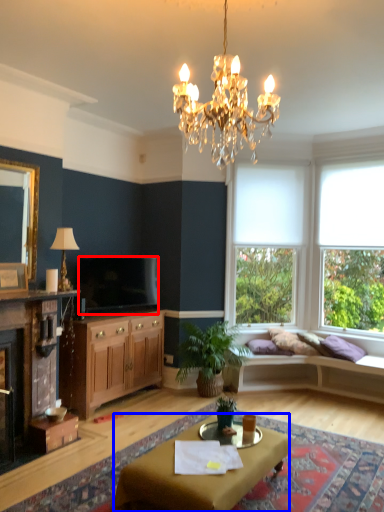
Question: Which point is closer to the camera, television (highlighted by a red box) or desk (highlighted by a blue box)?

Choices:
 (A) television
 (B) desk

Answer: (B)